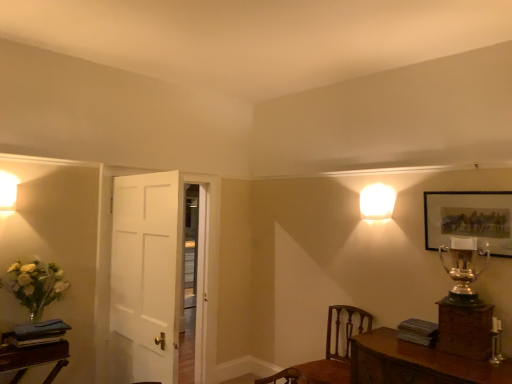
Question: From a real-world perspective, is gold metallic trophy at upper right beneath white glossy square at upper right, acting as the 1th lamp starting from the back?

Choices:
 (A) no
 (B) yes

Answer: (B)

Question: Considering the relative sizes of gold metallic trophy at upper right and white glossy square at upper right, acting as the 1th lamp starting from the back, in the image provided, is gold metallic trophy at upper right shorter than white glossy square at upper right, acting as the 1th lamp starting from the back,?

Choices:
 (A) yes
 (B) no

Answer: (B)

Question: Is gold metallic trophy at upper right surrounding white glossy square at upper right, which is counted as the 2th lamp, starting from the front?

Choices:
 (A) yes
 (B) no

Answer: (B)

Question: From the image's perspective, is gold metallic trophy at upper right under white glossy square at upper right, which is counted as the 2th lamp, starting from the front?

Choices:
 (A) no
 (B) yes

Answer: (B)

Question: Is gold metallic trophy at upper right placed right next to white glossy square at upper right, which is counted as the 2th lamp, starting from the front?

Choices:
 (A) no
 (B) yes

Answer: (A)

Question: Does gold metallic trophy at upper right have a greater height compared to white glossy square at upper right, acting as the 1th lamp starting from the back?

Choices:
 (A) yes
 (B) no

Answer: (A)

Question: Is the position of white glossy square at upper right, which is the first lamp from right to left, less distant than that of gold metallic trophy at upper right?

Choices:
 (A) yes
 (B) no

Answer: (B)

Question: Is white glossy square at upper right, the 2th lamp positioned from the left, with gold metallic trophy at upper right?

Choices:
 (A) no
 (B) yes

Answer: (A)

Question: Can you confirm if white glossy square at upper right, which is counted as the 2th lamp, starting from the front, is positioned to the left of gold metallic trophy at upper right?

Choices:
 (A) yes
 (B) no

Answer: (A)

Question: From a real-world perspective, is white glossy square at upper right, which is the first lamp from right to left, positioned under gold metallic trophy at upper right based on gravity?

Choices:
 (A) no
 (B) yes

Answer: (A)

Question: Does white glossy square at upper right, which is the first lamp from right to left, come behind gold metallic trophy at upper right?

Choices:
 (A) yes
 (B) no

Answer: (A)

Question: Does white glossy square at upper right, acting as the 1th lamp starting from the back, have a smaller size compared to gold metallic trophy at upper right?

Choices:
 (A) no
 (B) yes

Answer: (B)

Question: Does matte gold picture frame at upper right contain white glossy square at upper right, which is counted as the 2th lamp, starting from the front?

Choices:
 (A) yes
 (B) no

Answer: (B)